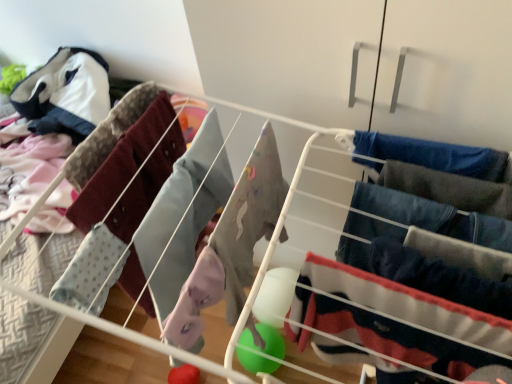
Question: From a real-world perspective, is velvet navy pants at center right, the 3th clothing positioned from the right, positioned over denim jeans at right, acting as the 2th clothing starting from the right, based on gravity?

Choices:
 (A) no
 (B) yes

Answer: (A)

Question: Is there a large distance between velvet navy pants at center right, the 3th clothing positioned from the right, and denim jeans at right, acting as the 2th clothing starting from the right?

Choices:
 (A) no
 (B) yes

Answer: (A)

Question: Could you tell me if velvet navy pants at center right, placed as the 2th clothing when sorted from left to right, is turned towards denim jeans at right, acting as the 2th clothing starting from the right?

Choices:
 (A) no
 (B) yes

Answer: (A)

Question: From the image's perspective, is velvet navy pants at center right, placed as the 2th clothing when sorted from left to right, on denim jeans at right, which is the 3th clothing from left to right?

Choices:
 (A) yes
 (B) no

Answer: (B)

Question: Is velvet navy pants at center right, placed as the 2th clothing when sorted from left to right, next to denim jeans at right, acting as the 2th clothing starting from the right, and touching it?

Choices:
 (A) no
 (B) yes

Answer: (A)

Question: Is velvet navy pants at center right, placed as the 2th clothing when sorted from left to right, to the left of denim jeans at right, acting as the 2th clothing starting from the right, from the viewer's perspective?

Choices:
 (A) no
 (B) yes

Answer: (B)

Question: Considering the relative sizes of denim jeans at right, which is the 3th clothing from left to right, and dark blue fabric pants at right, the fourth clothing positioned from the left, in the image provided, is denim jeans at right, which is the 3th clothing from left to right, shorter than dark blue fabric pants at right, the fourth clothing positioned from the left,?

Choices:
 (A) no
 (B) yes

Answer: (A)

Question: Could you tell me if denim jeans at right, which is the 3th clothing from left to right, is turned towards dark blue fabric pants at right, the fourth clothing positioned from the left?

Choices:
 (A) yes
 (B) no

Answer: (A)

Question: From the image's perspective, is denim jeans at right, acting as the 2th clothing starting from the right, beneath dark blue fabric pants at right, the fourth clothing positioned from the left?

Choices:
 (A) no
 (B) yes

Answer: (A)

Question: Is denim jeans at right, which is the 3th clothing from left to right, thinner than dark blue fabric pants at right, the fourth clothing positioned from the left?

Choices:
 (A) no
 (B) yes

Answer: (A)

Question: From a real-world perspective, is denim jeans at right, which is the 3th clothing from left to right, located higher than dark blue fabric pants at right, which ranks as the 1th clothing in right-to-left order?

Choices:
 (A) yes
 (B) no

Answer: (B)

Question: Can you confirm if denim jeans at right, acting as the 2th clothing starting from the right, is wider than dark blue fabric pants at right, which ranks as the 1th clothing in right-to-left order?

Choices:
 (A) no
 (B) yes

Answer: (B)

Question: Is light blue fabric at left, which ranks as the 1th clothing in left-to-right order, directly adjacent to denim jeans at right, which is the 3th clothing from left to right?

Choices:
 (A) no
 (B) yes

Answer: (A)